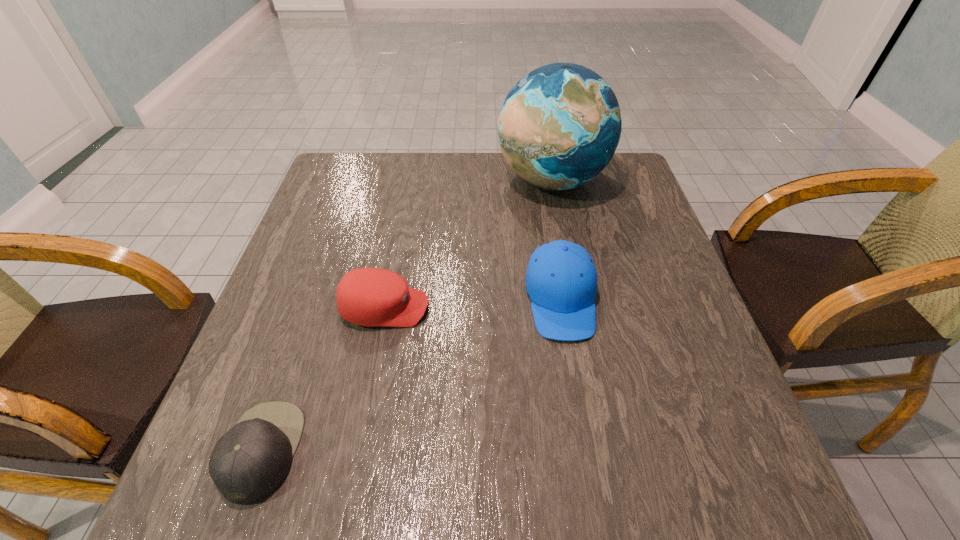
Find the location of a particular element. The image size is (960, 540). unoccupied area between the leftmost cap and the second cap from right to left is located at coordinates (324, 379).

At what (x,y) coordinates should I click in order to perform the action: click on the closest object to the rightmost cap. Please return your answer as a coordinate pair (x, y). Image resolution: width=960 pixels, height=540 pixels. Looking at the image, I should click on (x=559, y=127).

Find the location of a particular element. This screenshot has width=960, height=540. the third closest object to the tallest cap is located at coordinates (250, 461).

Identify which cap is the nearest to the tallest cap. Please provide its 2D coordinates. Your answer should be formatted as a tuple, i.e. [(x, y)], where the tuple contains the x and y coordinates of a point satisfying the conditions above.

[(369, 297)]

This screenshot has width=960, height=540. Identify the location of cap that is the second closest to the tallest cap. (250, 461).

Where is `free spot that satisfies the following two spatial constraints: 1. on the front-facing side of the rightmost cap; 2. on the front-facing side of the third object from right to left`? Image resolution: width=960 pixels, height=540 pixels. free spot that satisfies the following two spatial constraints: 1. on the front-facing side of the rightmost cap; 2. on the front-facing side of the third object from right to left is located at coordinates (563, 308).